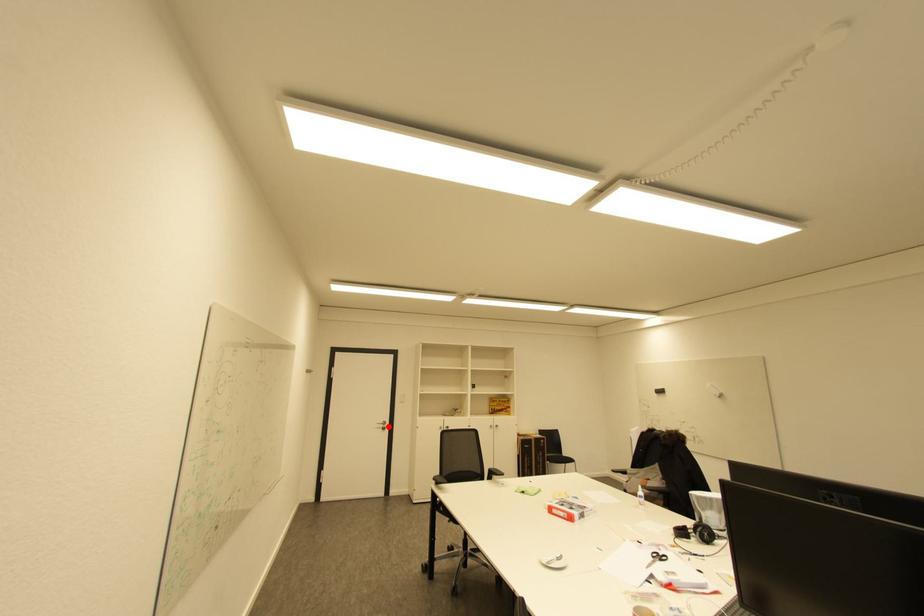
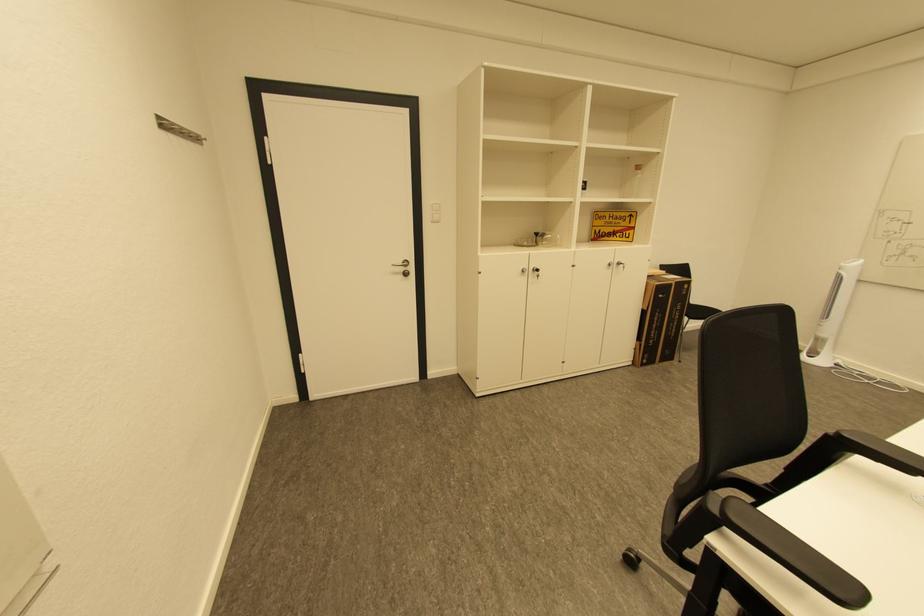
Locate, in the second image, the point that corresponds to the highlighted location in the first image.

(408, 270)